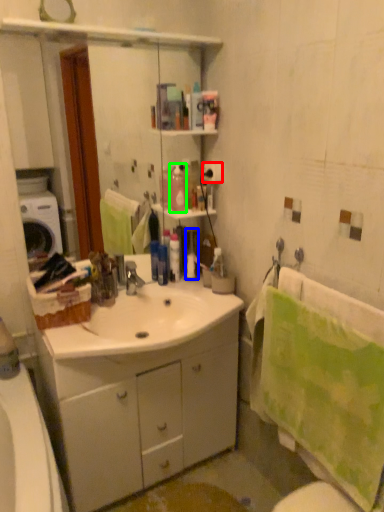
Question: Which object is positioned farthest from toilet paper (highlighted by a red box)? Select from toiletry (highlighted by a blue box) and cleaning product (highlighted by a green box).

Choices:
 (A) toiletry
 (B) cleaning product

Answer: (A)